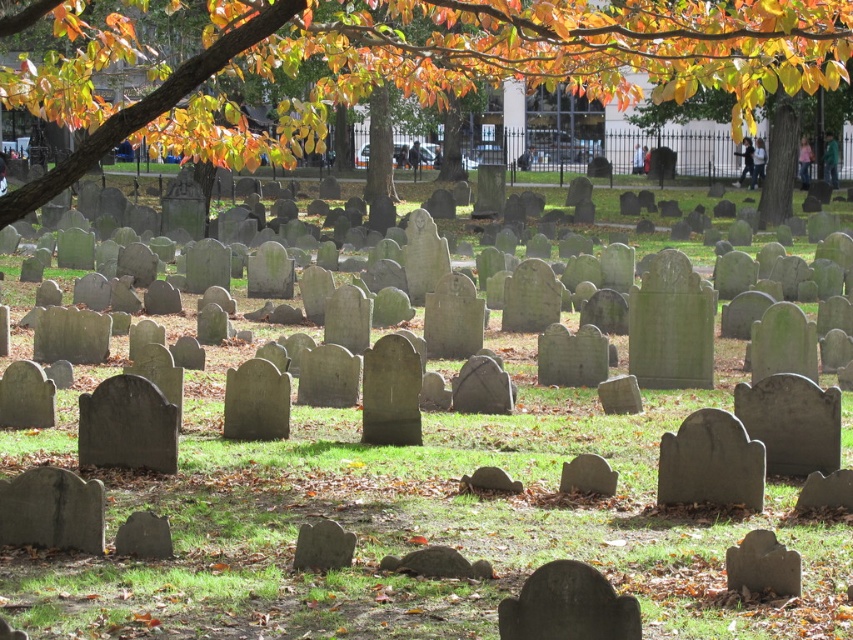
Is point (846, 48) positioned before point (676, 3)?

That is True.

Is point (119, 33) in front of point (770, 83)?

No, (119, 33) is behind (770, 83).

This screenshot has width=853, height=640. I want to click on autumn leaves at upper center, so click(x=409, y=65).